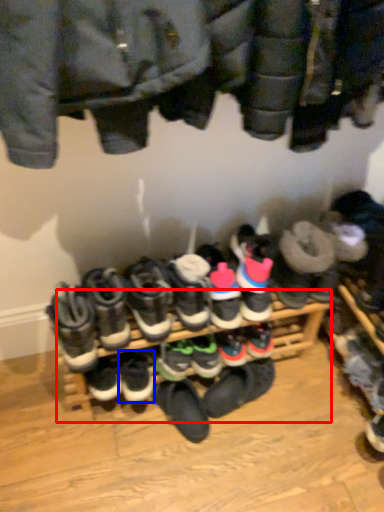
Question: Among these objects, which one is nearest to the camera, shelf (highlighted by a red box) or footwear (highlighted by a blue box)?

Choices:
 (A) shelf
 (B) footwear

Answer: (A)